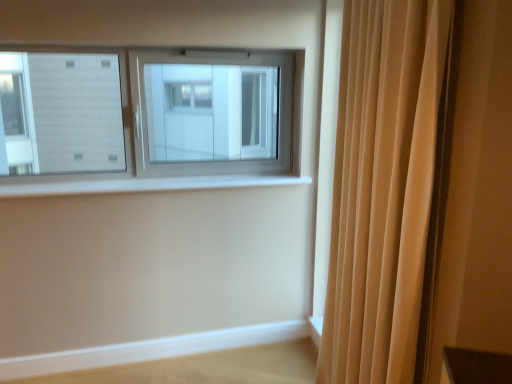
Question: Does beige fabric curtain at right have a larger size compared to white smooth window sill at center?

Choices:
 (A) yes
 (B) no

Answer: (A)

Question: Can you confirm if beige fabric curtain at right is positioned to the right of white smooth window sill at center?

Choices:
 (A) yes
 (B) no

Answer: (A)

Question: Is white smooth window sill at center a part of beige fabric curtain at right?

Choices:
 (A) no
 (B) yes

Answer: (A)

Question: Are beige fabric curtain at right and white smooth window sill at center far apart?

Choices:
 (A) no
 (B) yes

Answer: (B)

Question: Could you tell me if beige fabric curtain at right is facing white smooth window sill at center?

Choices:
 (A) yes
 (B) no

Answer: (B)

Question: Is light wood ledge at lower right taller or shorter than white smooth window sill at center?

Choices:
 (A) tall
 (B) short

Answer: (A)

Question: In terms of size, does light wood ledge at lower right appear bigger or smaller than white smooth window sill at center?

Choices:
 (A) big
 (B) small

Answer: (B)

Question: From the image's perspective, is light wood ledge at lower right located above or below white smooth window sill at center?

Choices:
 (A) above
 (B) below

Answer: (B)

Question: From a real-world perspective, relative to white smooth window sill at center, is light wood ledge at lower right vertically above or below?

Choices:
 (A) below
 (B) above

Answer: (A)

Question: Is white smooth window sill at center situated inside light wood ledge at lower right or outside?

Choices:
 (A) inside
 (B) outside

Answer: (B)

Question: Is point (33, 183) positioned closer to the camera than point (76, 357)?

Choices:
 (A) farther
 (B) closer

Answer: (B)

Question: In terms of width, does white smooth window sill at center look wider or thinner when compared to light wood ledge at lower right?

Choices:
 (A) wide
 (B) thin

Answer: (A)

Question: From a real-world perspective, is white smooth window sill at center positioned above or below light wood ledge at lower right?

Choices:
 (A) above
 (B) below

Answer: (A)

Question: Do you think white smooth window sill at center is within beige fabric curtain at right, or outside of it?

Choices:
 (A) outside
 (B) inside

Answer: (A)

Question: Considering the positions of point (134, 178) and point (404, 246), is point (134, 178) closer or farther from the camera than point (404, 246)?

Choices:
 (A) closer
 (B) farther

Answer: (B)